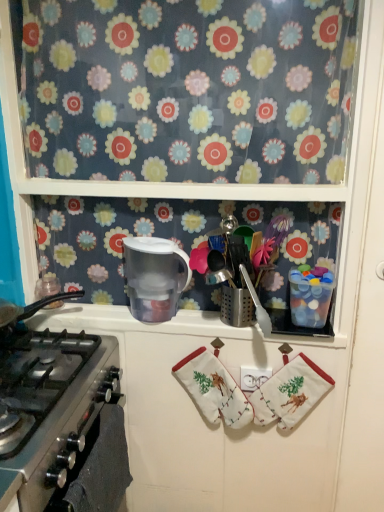
Question: Would you say black matte oven at lower left is inside or outside transparent plastic pitcher at upper center, the 1th appliance positioned from the left?

Choices:
 (A) outside
 (B) inside

Answer: (A)

Question: Is black matte oven at lower left bigger or smaller than transparent plastic pitcher at upper center, arranged as the 2th appliance when viewed from the right?

Choices:
 (A) big
 (B) small

Answer: (B)

Question: Which of these objects is positioned farthest from the white cotton hand towel at center, the second hand towel from the left?

Choices:
 (A) white cotton hand towel at center, which ranks as the first hand towel in left-to-right order
 (B) translucent plastic water filter at center
 (C) translucent plastic container at upper right, positioned as the 1th appliance in right-to-left order
 (D) floral fabric curtain at upper center
 (E) black matte oven at lower left

Answer: (D)

Question: Estimate the real-world distances between objects in this image. Which object is farther from the translucent plastic water filter at center?

Choices:
 (A) white cotton hand towel at center, which ranks as the first hand towel in left-to-right order
 (B) translucent plastic container at upper right, acting as the 2th appliance starting from the left
 (C) black matte oven at lower left
 (D) white cotton hand towel at center, the second hand towel from the left
 (E) silver metallic gas stove at lower left

Answer: (C)